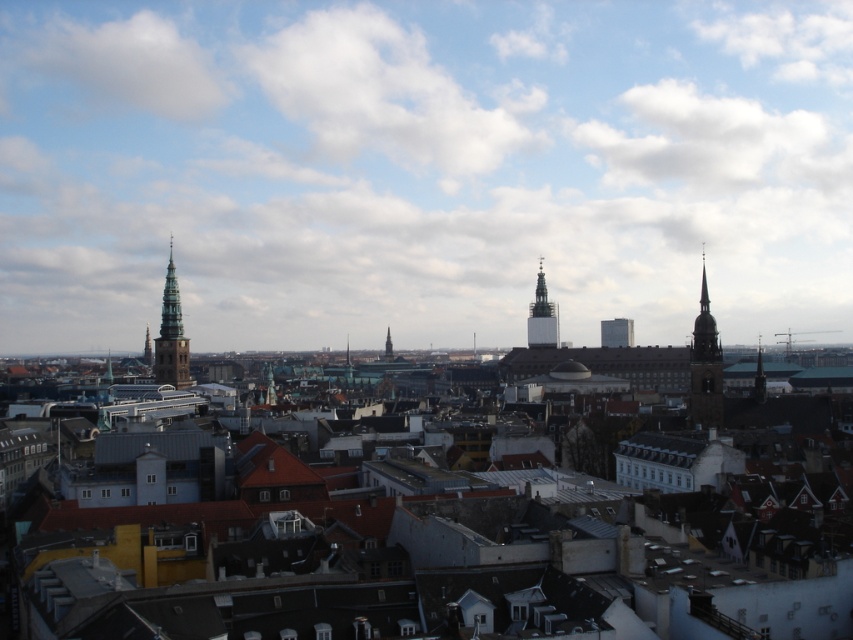
Question: Is brown stone tower at right positioned in front of smooth gray spire at center-left?

Choices:
 (A) yes
 (B) no

Answer: (A)

Question: Can you confirm if brown stone tower at right is wider than smooth gray spire at center-left?

Choices:
 (A) no
 (B) yes

Answer: (B)

Question: Does smooth gray spire at center-left appear under dark brown stone spire at right?

Choices:
 (A) no
 (B) yes

Answer: (A)

Question: Among these objects, which one is farthest from the camera?

Choices:
 (A) smooth gray spire at center-left
 (B) brown stone tower at right
 (C) smooth white tower at center

Answer: (C)

Question: Which is nearer to the smooth white tower at center?

Choices:
 (A) dark brown stone spire at right
 (B) brown stone tower at right
 (C) smooth gray spire at center-left

Answer: (A)

Question: Which of the following is the farthest from the observer?

Choices:
 (A) (759, 380)
 (B) (177, 323)

Answer: (B)